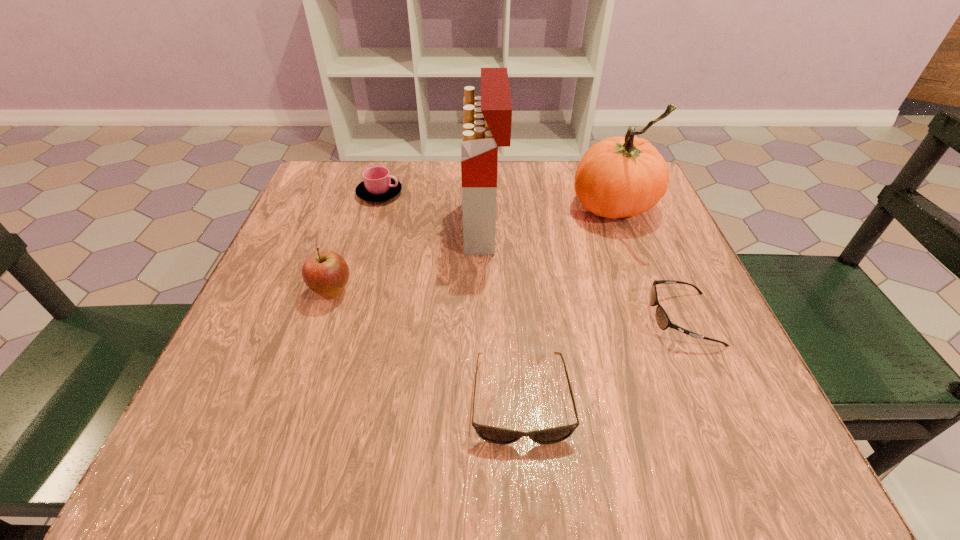
At what (x,y) coordinates should I click in order to perform the action: click on vacant area that lies between the apple and the nearest object. Please return your answer as a coordinate pair (x, y). The image size is (960, 540). Looking at the image, I should click on (426, 345).

Locate an element on the screen. This screenshot has width=960, height=540. blank region between the apple and the nearest object is located at coordinates (426, 345).

This screenshot has height=540, width=960. In order to click on object that is the second closest to the cigarette case in this screenshot , I will do `click(618, 177)`.

Identify which object is the fifth nearest to the right sunglasses. Please provide its 2D coordinates. Your answer should be formatted as a tuple, i.e. [(x, y)], where the tuple contains the x and y coordinates of a point satisfying the conditions above.

[(378, 185)]

Locate an element on the screen. free space in the image that satisfies the following two spatial constraints: 1. on the front-facing side of the farther sunglasses; 2. on the lenses of the left sunglasses is located at coordinates (717, 399).

You are a GUI agent. You are given a task and a screenshot of the screen. Output one action in this format:
    pyautogui.click(x=<x>, y=<y>)
    Task: Click on the free location that satisfies the following two spatial constraints: 1. on the back side of the pumpkin; 2. on the side with the handle of the cup
    This screenshot has height=540, width=960.
    Given the screenshot: What is the action you would take?
    pyautogui.click(x=609, y=193)